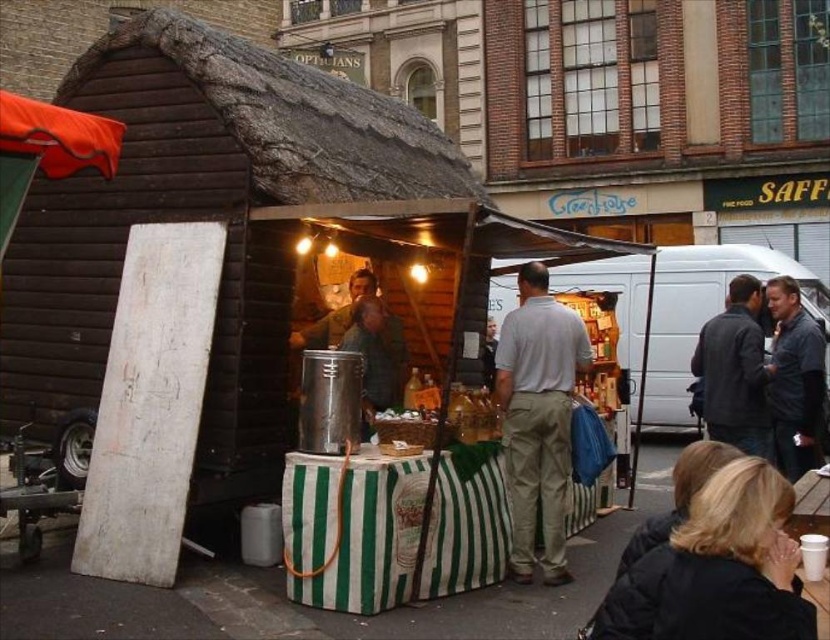
You are a customer waiting in line at the food stall. You notice a black jacket at lower right and a matte silver food truck at center. Which object is closer to you?

The black jacket at lower right is closer to you because it is positioned under the matte silver food truck at center, indicating it is in a lower, more forward position.

You are standing at the entrance of the food stall and want to place a new menu board. The menu board requires a space of 0.1 units in width and height. Is there enough space at the location of the black jacket at lower right to place it?

The black jacket at lower right is located at point (716, 568). Since the menu board requires 0.1 units in width and height, and the coordinates are precise points, there is insufficient space to place the menu board here as it would require a small area around the point.